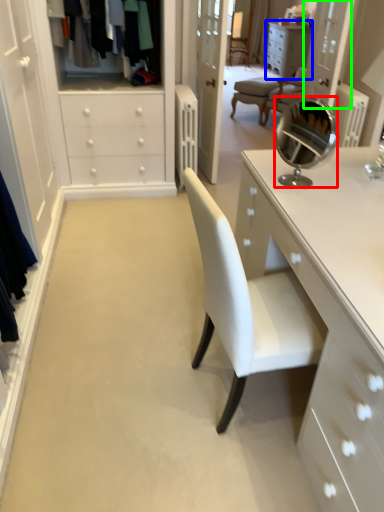
Question: Considering the real-world distances, which object is farthest from mirror (highlighted by a red box)? cabinetry (highlighted by a blue box) or glass door (highlighted by a green box)?

Choices:
 (A) cabinetry
 (B) glass door

Answer: (A)